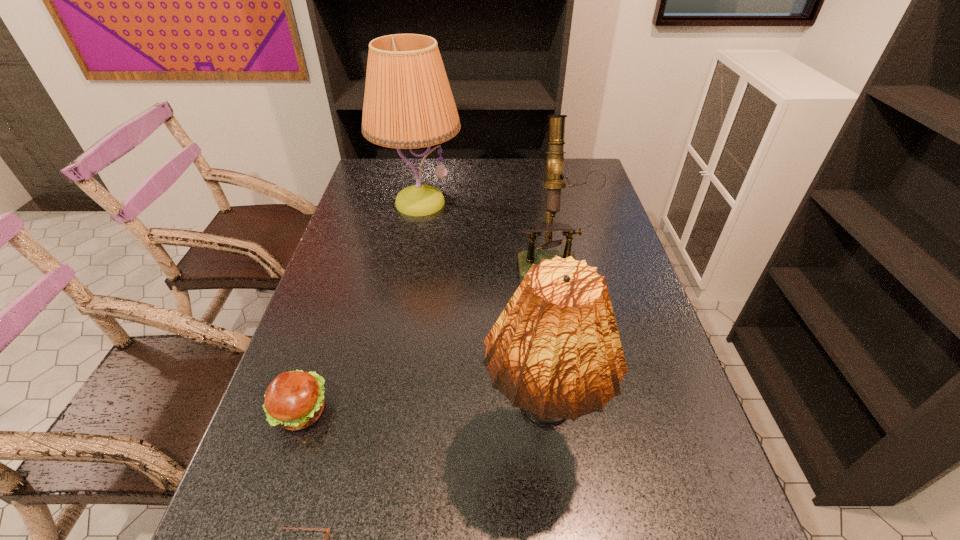
At what (x,y) coordinates should I click in order to perform the action: click on free space between the lampshade and the hamburger. Please return your answer as a coordinate pair (x, y). The width and height of the screenshot is (960, 540). Looking at the image, I should click on (419, 424).

The height and width of the screenshot is (540, 960). Identify the location of empty location between the fourth tallest object and the lamp. (360, 307).

You are a GUI agent. You are given a task and a screenshot of the screen. Output one action in this format:
    pyautogui.click(x=<x>, y=<y>)
    Task: Click on the free space between the fourth nearest object and the farthest object
    The image size is (960, 540).
    Given the screenshot: What is the action you would take?
    pyautogui.click(x=486, y=231)

This screenshot has height=540, width=960. Find the location of `free spot between the lamp and the hamburger`. free spot between the lamp and the hamburger is located at coordinates (360, 307).

Select which object is the fourth closest to the shortest object. Please provide its 2D coordinates. Your answer should be formatted as a tuple, i.e. [(x, y)], where the tuple contains the x and y coordinates of a point satisfying the conditions above.

[(408, 103)]

At what (x,y) coordinates should I click in order to perform the action: click on object that is the third closest to the lamp. Please return your answer as a coordinate pair (x, y). This screenshot has height=540, width=960. Looking at the image, I should click on (294, 400).